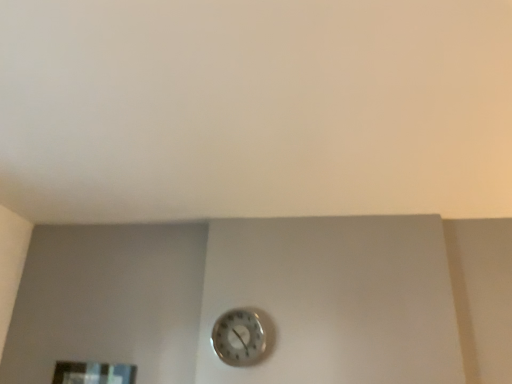
What do you see at coordinates (239, 337) in the screenshot? I see `metallic silver wall clock at center` at bounding box center [239, 337].

Where is `metallic silver wall clock at center`? metallic silver wall clock at center is located at coordinates (239, 337).

Locate an element on the screen. This screenshot has height=384, width=512. metallic silver wall clock at center is located at coordinates (239, 337).